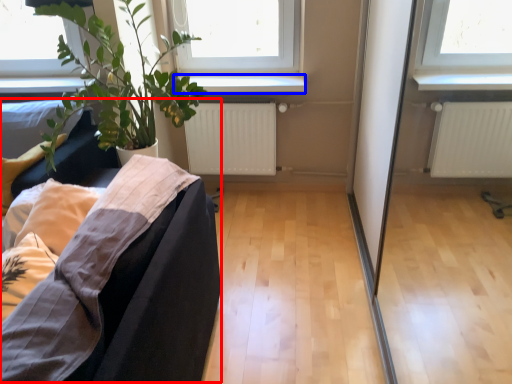
Question: Which of the following is the closest to the observer, couch (highlighted by a red box) or window sill (highlighted by a blue box)?

Choices:
 (A) couch
 (B) window sill

Answer: (A)